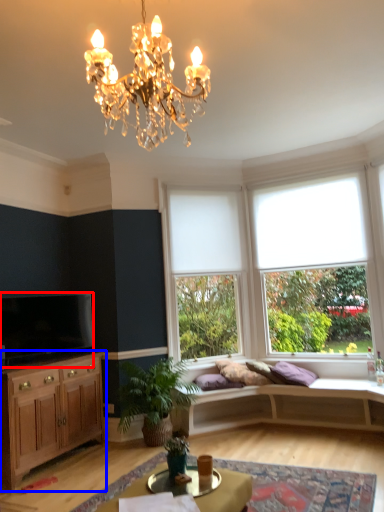
Question: Which object is closer to the camera taking this photo, television (highlighted by a red box) or cabinetry (highlighted by a blue box)?

Choices:
 (A) television
 (B) cabinetry

Answer: (B)